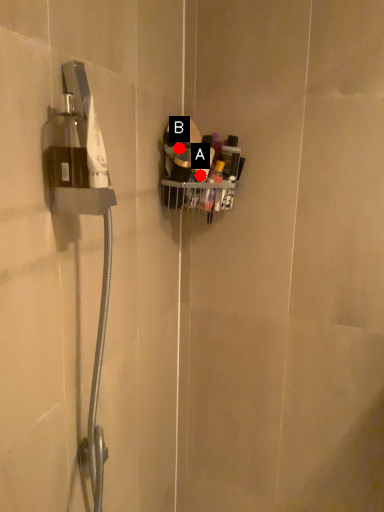
Question: Two points are circled on the image, labeled by A and B beside each circle. Which point is closer to the camera taking this photo?

Choices:
 (A) A is closer
 (B) B is closer

Answer: (B)